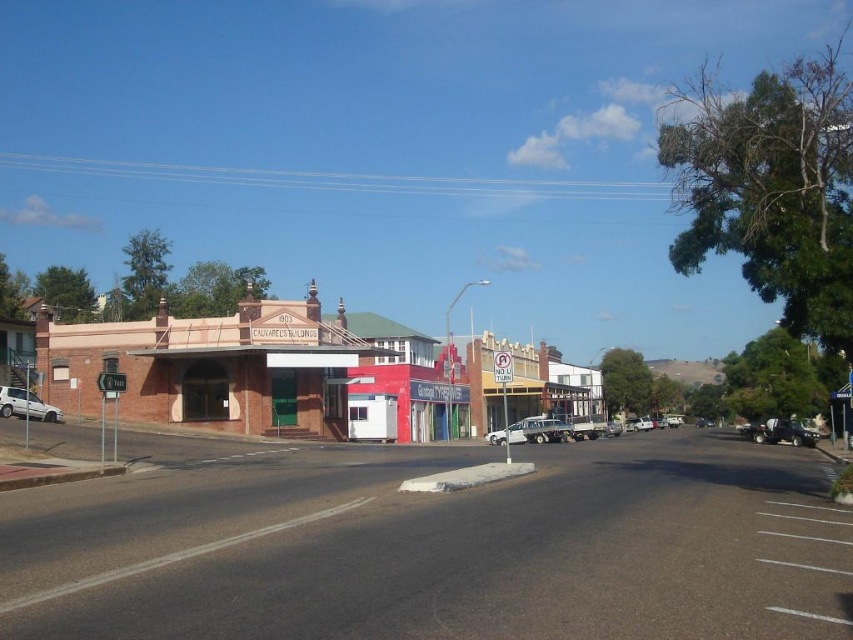
Is smooth asphalt road at center thinner than brick building at center?

Correct, smooth asphalt road at center's width is less than brick building at center's.

Between smooth asphalt road at center and brick building at center, which one appears on the right side from the viewer's perspective?

brick building at center

Who is more forward, (39,580) or (231,339)?

Point (39,580)

Identify the location of smooth asphalt road at center. This screenshot has width=853, height=640. (439, 547).

This screenshot has width=853, height=640. What do you see at coordinates (529, 432) in the screenshot?
I see `white metallic car at center` at bounding box center [529, 432].

Is white metallic car at center closer to the viewer compared to white matte car at lower left?

No, white metallic car at center is behind white matte car at lower left.

Who is more distant from viewer, (561, 428) or (6, 412)?

The point (561, 428) is more distant.

At what (x,y) coordinates should I click in order to perform the action: click on white metallic car at center. Please return your answer as a coordinate pair (x, y). The image size is (853, 640). Looking at the image, I should click on (529, 432).

Which is in front, point (345, 381) or point (4, 396)?

Point (4, 396) is in front.

Can you confirm if brick building at center is bigger than white matte car at lower left?

Yes.

Is point (447, 384) closer to camera compared to point (59, 410)?

No, (447, 384) is further to viewer.

This screenshot has height=640, width=853. Identify the location of brick building at center. (247, 371).